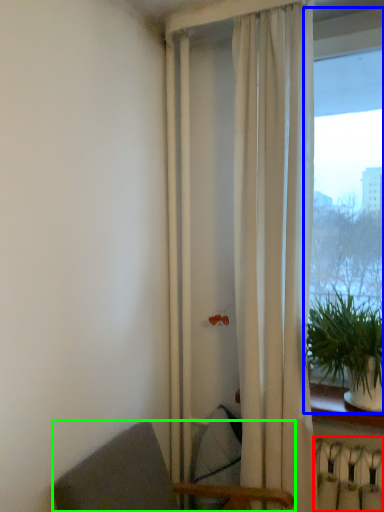
Question: Which object is positioned farthest from radiator (highlighted by a red box)? Select from window (highlighted by a blue box) and chair (highlighted by a green box).

Choices:
 (A) window
 (B) chair

Answer: (A)